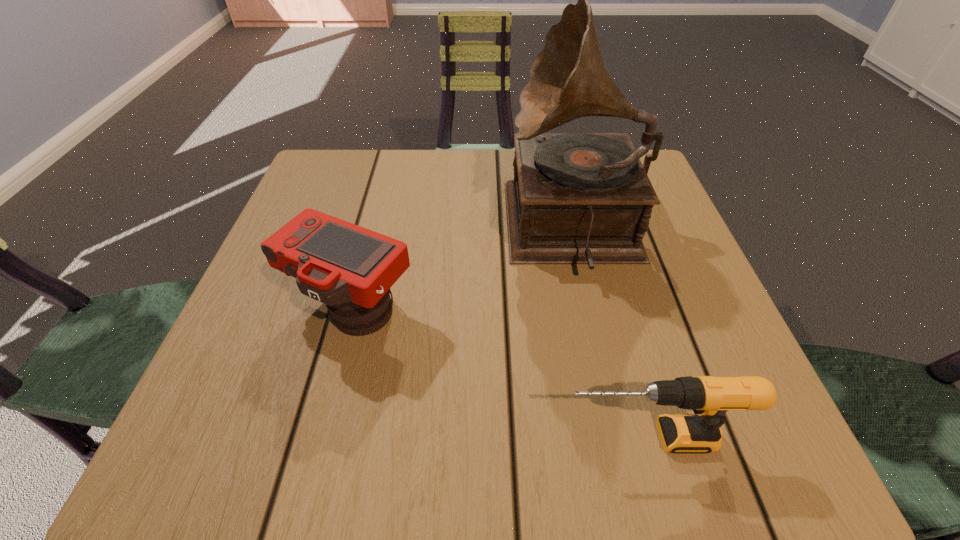
You are a GUI agent. You are given a task and a screenshot of the screen. Output one action in this format:
    pyautogui.click(x=<x>, y=<y>)
    Task: Click on the tallest object
    
    Given the screenshot: What is the action you would take?
    pyautogui.click(x=577, y=198)

You are a GUI agent. You are given a task and a screenshot of the screen. Output one action in this format:
    pyautogui.click(x=<x>, y=<y>)
    Task: Click on the camera
    
    Given the screenshot: What is the action you would take?
    pyautogui.click(x=350, y=269)

I want to click on drill, so click(711, 397).

Locate an element on the screen. This screenshot has height=540, width=960. free location located from the horn of the record player is located at coordinates (468, 230).

I want to click on vacant space situated 0.260m from the horn of the record player, so click(377, 230).

Locate an element on the screen. The width and height of the screenshot is (960, 540). free location located from the horn of the record player is located at coordinates (397, 230).

Where is `vacant space situated on the front of the camera`? Image resolution: width=960 pixels, height=540 pixels. vacant space situated on the front of the camera is located at coordinates (311, 466).

You are a GUI agent. You are given a task and a screenshot of the screen. Output one action in this format:
    pyautogui.click(x=<x>, y=<y>)
    Task: Click on the free region located on the handle side of the drill
    
    Given the screenshot: What is the action you would take?
    pyautogui.click(x=350, y=437)

Locate an element on the screen. free space located 0.110m on the handle side of the drill is located at coordinates (479, 437).

Find the location of a particular element. vacant space situated on the handle side of the drill is located at coordinates (411, 437).